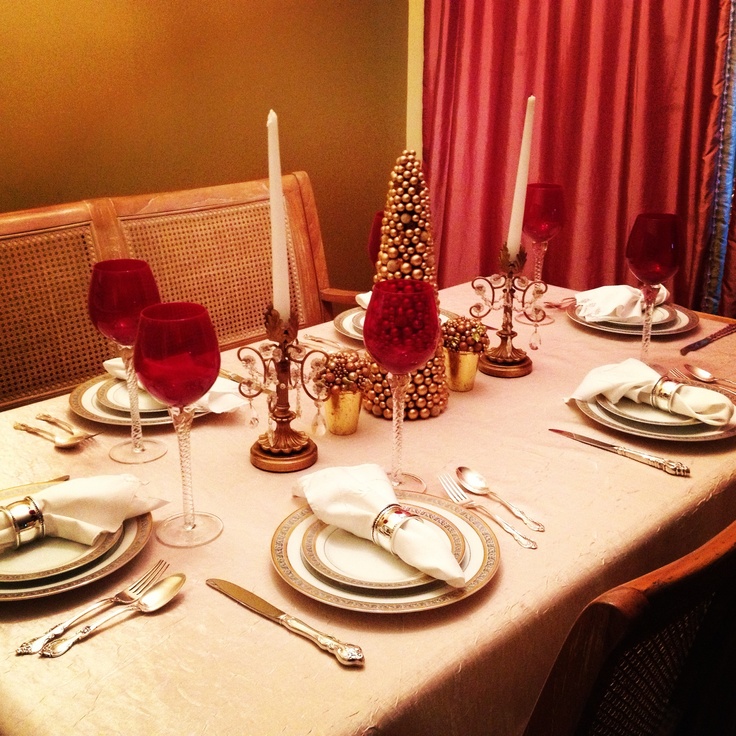
Where is `forks`? The image size is (736, 736). forks is located at coordinates (143, 580), (463, 498), (678, 372), (92, 434), (341, 339), (558, 305).